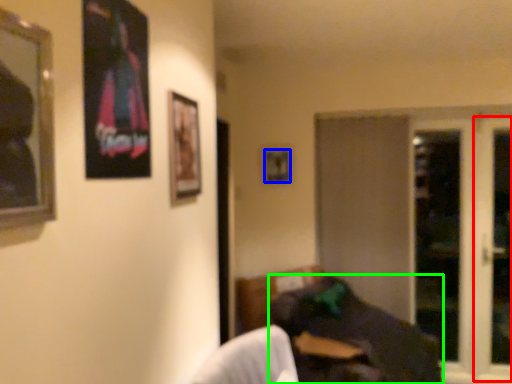
Question: Based on their relative distances, which object is nearer to screen door (highlighted by a red box)? Choose from picture frame (highlighted by a blue box) and bean bag chair (highlighted by a green box).

Choices:
 (A) picture frame
 (B) bean bag chair

Answer: (B)